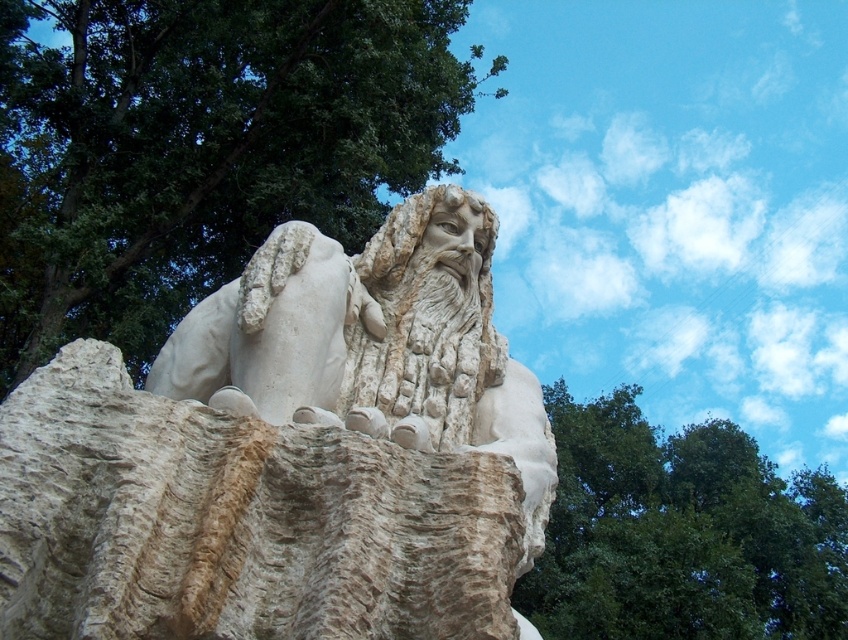
Question: Can you confirm if green leafy tree at upper left is thinner than green leafy tree at upper right?

Choices:
 (A) yes
 (B) no

Answer: (A)

Question: Can you confirm if green leafy tree at upper left is positioned above green leafy tree at upper right?

Choices:
 (A) yes
 (B) no

Answer: (A)

Question: Is green leafy tree at upper left bigger than green leafy tree at upper right?

Choices:
 (A) no
 (B) yes

Answer: (A)

Question: Which object appears closest to the camera in this image?

Choices:
 (A) green leafy tree at upper right
 (B) green leafy tree at upper left

Answer: (A)

Question: Among these objects, which one is farthest from the camera?

Choices:
 (A) green leafy tree at upper right
 (B) green leafy tree at upper left

Answer: (B)